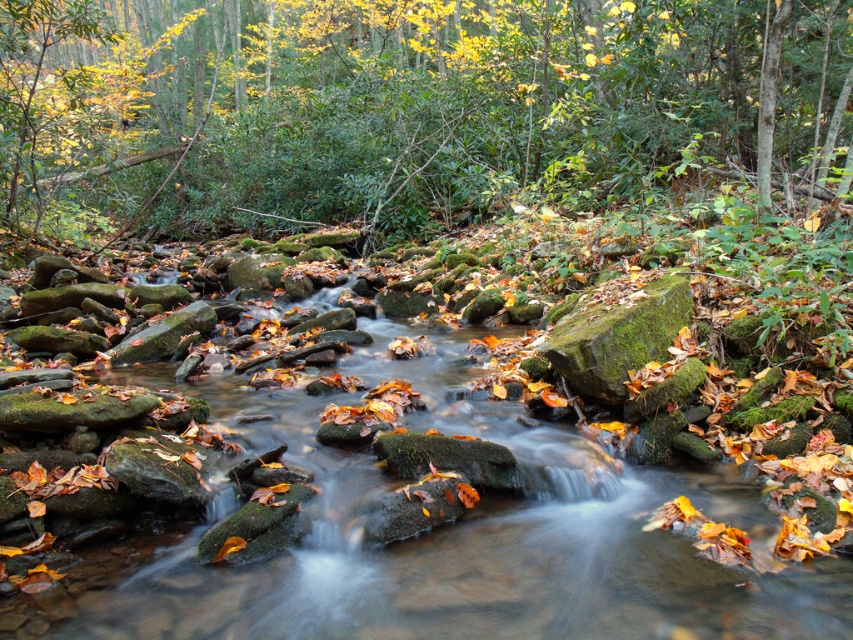
Question: Can you confirm if green mossy rocks at center is positioned below green leafy tree at upper center?

Choices:
 (A) no
 (B) yes

Answer: (B)

Question: Which point appears closest to the camera in this image?

Choices:
 (A) (817, 468)
 (B) (30, 152)

Answer: (A)

Question: Among these objects, which one is farthest from the camera?

Choices:
 (A) green mossy rocks at center
 (B) green leafy tree at upper center

Answer: (B)

Question: Is green mossy rocks at center to the left of green leafy tree at upper center from the viewer's perspective?

Choices:
 (A) yes
 (B) no

Answer: (B)

Question: Is green mossy rocks at center above green leafy tree at upper center?

Choices:
 (A) no
 (B) yes

Answer: (A)

Question: Which object appears closest to the camera in this image?

Choices:
 (A) green leafy tree at upper center
 (B) green mossy rocks at center

Answer: (B)